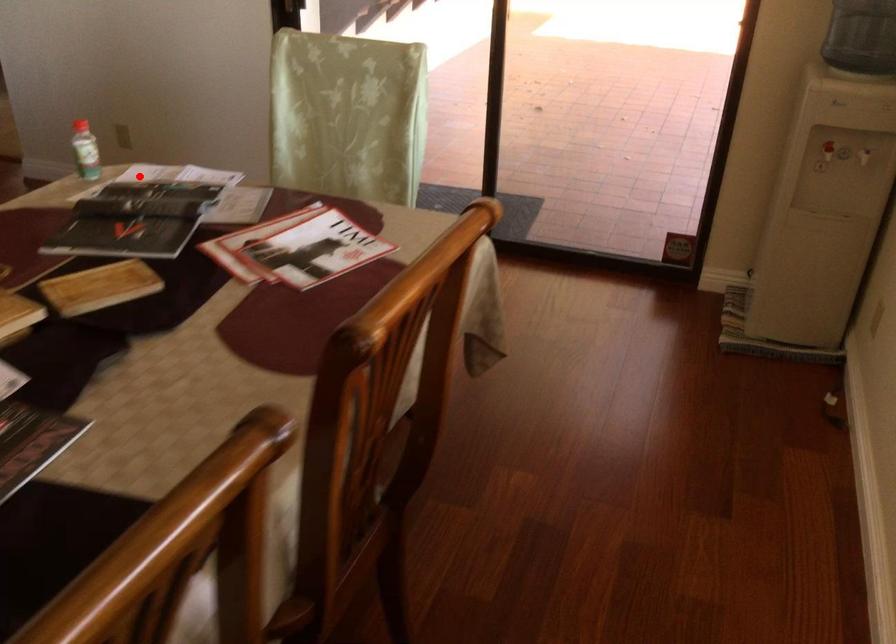
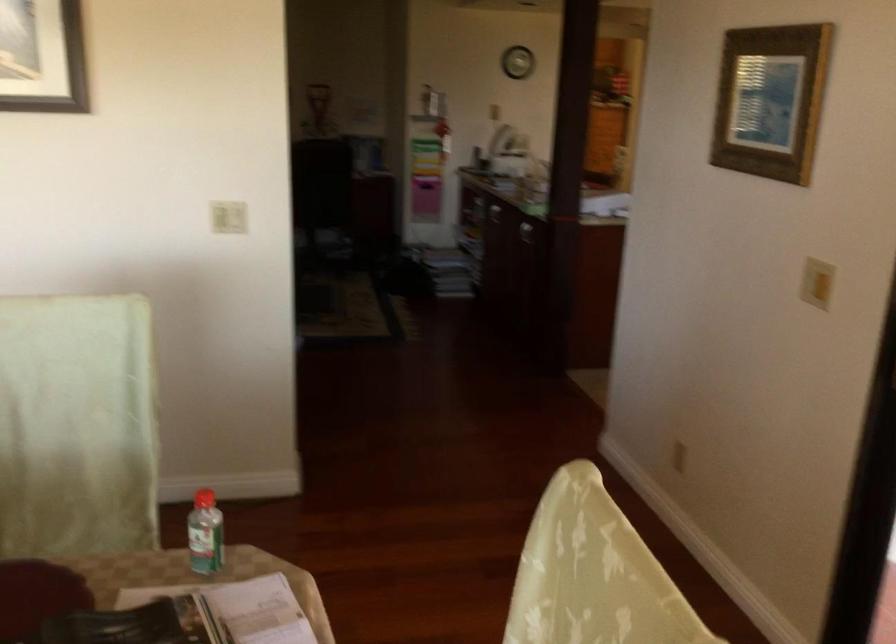
In the second image, find the point that corresponds to the highlighted location in the first image.

(238, 609)